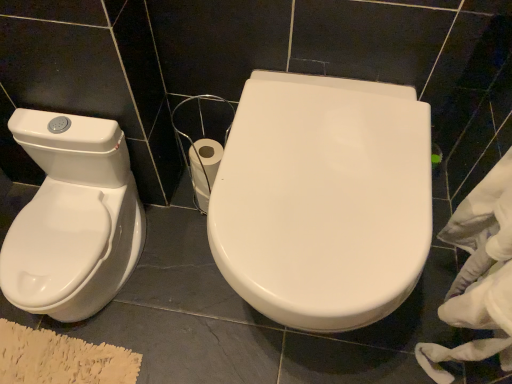
Question: Would you say white fabric at right contains white glossy toilet seat at center?

Choices:
 (A) yes
 (B) no

Answer: (B)

Question: Is white fabric at right not close to white glossy toilet seat at center?

Choices:
 (A) yes
 (B) no

Answer: (B)

Question: Is white fabric at right placed right next to white glossy toilet seat at center?

Choices:
 (A) no
 (B) yes

Answer: (A)

Question: Does white fabric at right appear on the right side of white glossy toilet seat at center?

Choices:
 (A) yes
 (B) no

Answer: (A)

Question: Is white fabric at right oriented towards white glossy toilet seat at center?

Choices:
 (A) yes
 (B) no

Answer: (A)

Question: From a real-world perspective, is white glossy bidet at left above or below white glossy toilet seat at center?

Choices:
 (A) above
 (B) below

Answer: (B)

Question: Which is correct: white glossy bidet at left is inside white glossy toilet seat at center, or outside of it?

Choices:
 (A) inside
 (B) outside

Answer: (B)

Question: Is point (129, 251) positioned closer to the camera than point (291, 201)?

Choices:
 (A) farther
 (B) closer

Answer: (A)

Question: Considering the positions of white glossy bidet at left and white glossy toilet seat at center in the image, is white glossy bidet at left wider or thinner than white glossy toilet seat at center?

Choices:
 (A) wide
 (B) thin

Answer: (B)

Question: Looking at their shapes, would you say white fabric at right is wider or thinner than white glossy bidet at left?

Choices:
 (A) thin
 (B) wide

Answer: (A)

Question: From the image's perspective, is white fabric at right located above or below white glossy bidet at left?

Choices:
 (A) above
 (B) below

Answer: (B)

Question: Looking at the image, does white fabric at right seem bigger or smaller compared to white glossy bidet at left?

Choices:
 (A) small
 (B) big

Answer: (A)

Question: Does point (463, 211) appear closer or farther from the camera than point (89, 226)?

Choices:
 (A) farther
 (B) closer

Answer: (B)

Question: In terms of height, does white glossy toilet seat at center look taller or shorter compared to white fabric at right?

Choices:
 (A) tall
 (B) short

Answer: (B)

Question: In terms of width, does white glossy toilet seat at center look wider or thinner when compared to white fabric at right?

Choices:
 (A) thin
 (B) wide

Answer: (B)